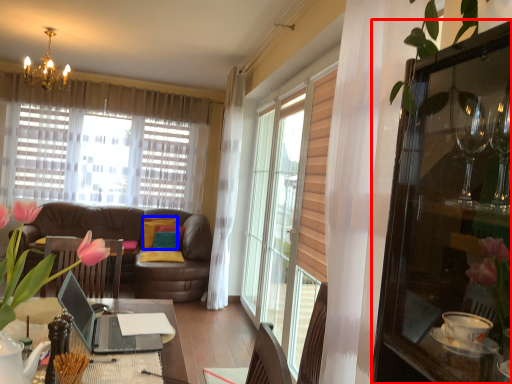
Question: Which of the following is the farthest to the observer, cabinetry (highlighted by a red box) or pillow (highlighted by a blue box)?

Choices:
 (A) cabinetry
 (B) pillow

Answer: (B)